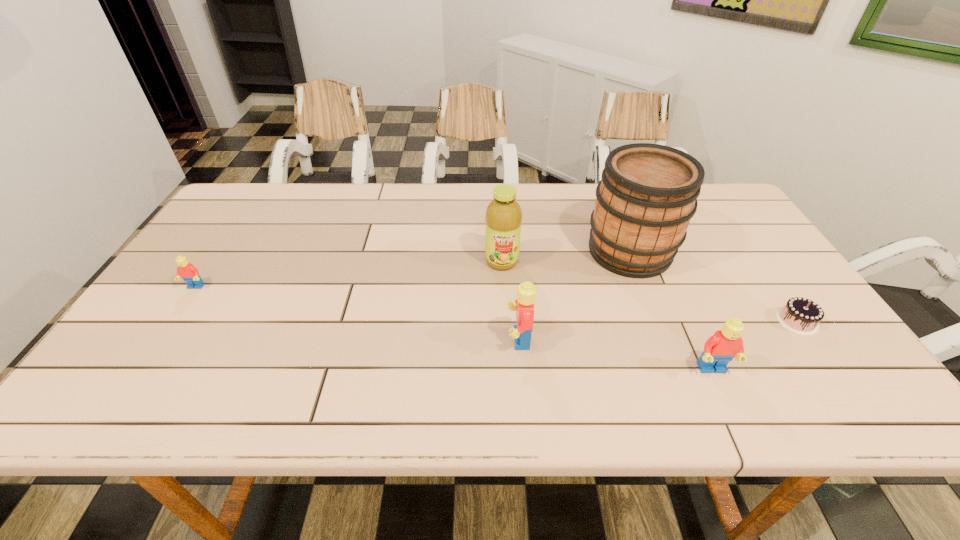
You are a GUI agent. You are given a task and a screenshot of the screen. Output one action in this format:
    pyautogui.click(x=<x>, y=<y>)
    Task: Click on the shortest Lego
    Image resolution: width=960 pixels, height=540 pixels.
    Given the screenshot: What is the action you would take?
    pyautogui.click(x=189, y=273)

Where is `the farthest Lego`? the farthest Lego is located at coordinates (189, 273).

Locate an element on the screen. the second farthest Lego is located at coordinates (526, 292).

This screenshot has height=540, width=960. What are the coordinates of `the second tallest Lego` in the screenshot? It's located at (723, 346).

Locate an element on the screen. This screenshot has width=960, height=540. the third shortest object is located at coordinates (723, 346).

Where is `chocolate cake`? The width and height of the screenshot is (960, 540). chocolate cake is located at coordinates (802, 316).

I want to click on the shortest object, so click(802, 316).

I want to click on the tallest object, so click(648, 194).

Where is `the fifth shortest object`? The height and width of the screenshot is (540, 960). the fifth shortest object is located at coordinates (503, 217).

Locate an element on the screen. Image resolution: width=960 pixels, height=540 pixels. vacant space located on the face of the farthest Lego is located at coordinates (169, 327).